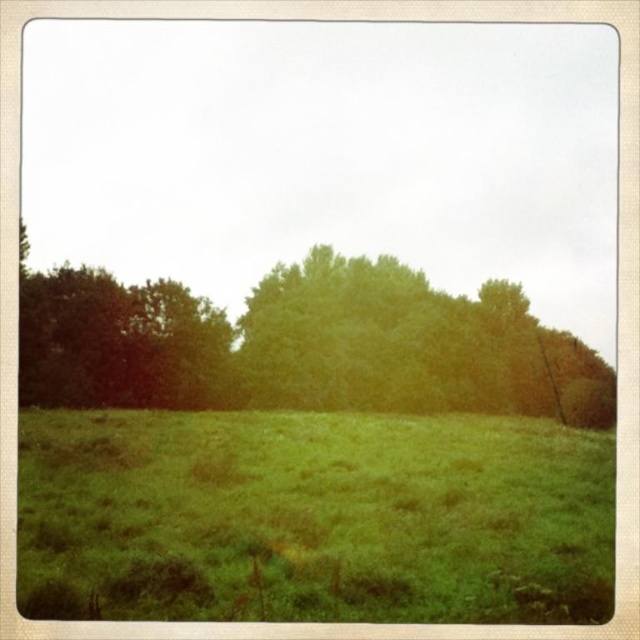
You are a photographer planning to capture a landscape shot of the green grassy field at center and the green leafy tree at center. Since both are green, how can you ensure the tree stands out in your photo?

The green grassy field at center is in front of the green leafy tree at center, so positioning yourself behind the field will place the tree in the background, creating depth and allowing the tree to stand out against the field.

You are standing in the middle of the field in the rural landscape scene. You see two points marked on the ground ahead of you at coordinates point (592, 433) and point (436, 360). Which point is closer to your current position?

Point (592, 433) is closer to the camera than point (436, 360), so the point closer to your current position is point (592, 433).